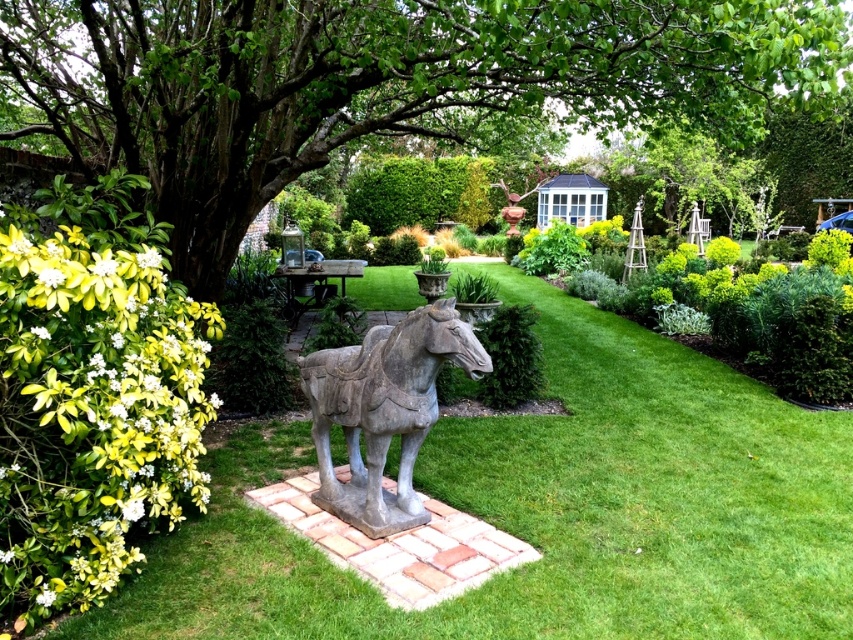
Between point (334, 609) and point (160, 4), which one is positioned in front?

Positioned in front is point (334, 609).

Who is positioned more to the right, green grass at center or green leafy tree at upper left?

green grass at center is more to the right.

At what (x,y) coordinates should I click in order to perform the action: click on green grass at center. Please return your answer as a coordinate pair (x, y). The width and height of the screenshot is (853, 640). Looking at the image, I should click on (550, 512).

Where is `green grass at center`? The height and width of the screenshot is (640, 853). green grass at center is located at coordinates (550, 512).

Can you confirm if green grass at center is positioned above gray stone horse at center?

No, green grass at center is not above gray stone horse at center.

Between green grass at center and gray stone horse at center, which one appears on the left side from the viewer's perspective?

gray stone horse at center is more to the left.

This screenshot has height=640, width=853. Identify the location of green grass at center. (550, 512).

I want to click on green grass at center, so click(550, 512).

Which of these two, green leafy tree at upper left or gray stone horse at center, stands shorter?

gray stone horse at center is shorter.

Does point (776, 81) lie in front of point (349, 365)?

No, it is behind (349, 365).

Is point (424, 102) behind point (354, 500)?

Yes, it is.

Where is `green leafy tree at upper left`? This screenshot has width=853, height=640. green leafy tree at upper left is located at coordinates (378, 83).